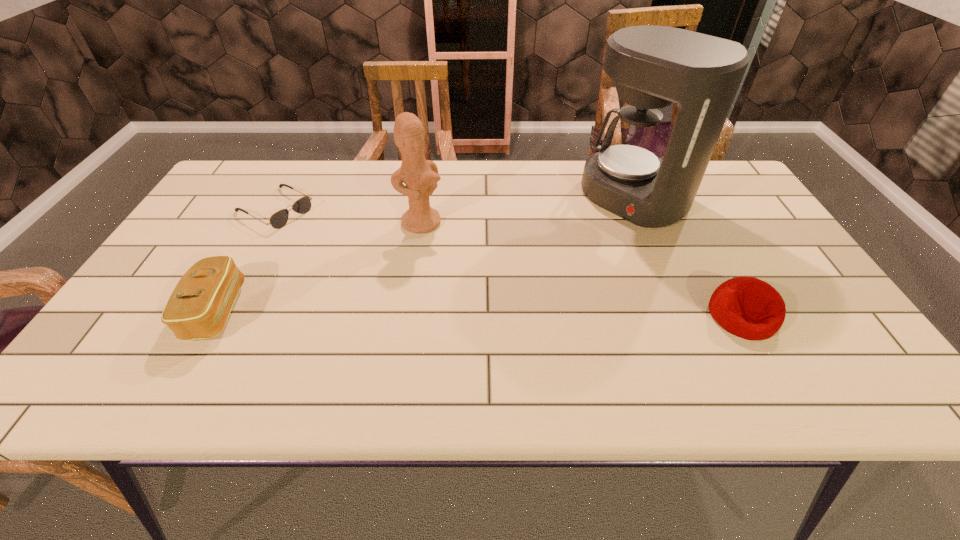
Identify the location of vacant space on the desktop that is between the clutch bag and the beanbag and is positioned on the front-facing side of the shortest object. (460, 313).

You are a GUI agent. You are given a task and a screenshot of the screen. Output one action in this format:
    pyautogui.click(x=<x>, y=<y>)
    Task: Click on the free spot on the desktop that is between the clutch bag and the beanbag and is positioned on the front-facing side of the figurine
    The image size is (960, 540).
    Given the screenshot: What is the action you would take?
    pyautogui.click(x=505, y=313)

Find the location of a particular element. vacant space on the desktop that is between the clutch bag and the beanbag and is positioned on the front-facing side of the coffee maker is located at coordinates (481, 313).